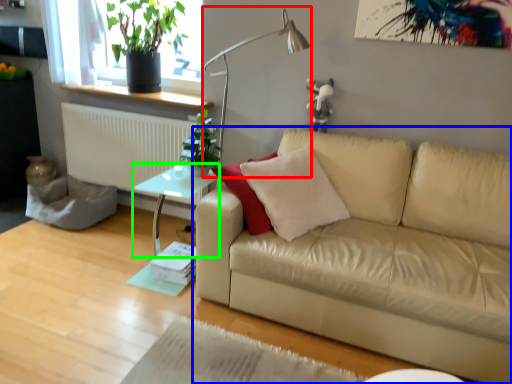
Question: Which is farther away from table lamp (highlighted by a red box)? studio couch (highlighted by a blue box) or table (highlighted by a green box)?

Choices:
 (A) studio couch
 (B) table

Answer: (A)